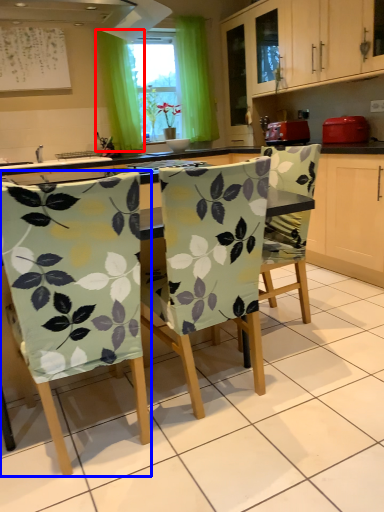
Question: Which of the following is the farthest to the observer, curtain (highlighted by a red box) or chair (highlighted by a blue box)?

Choices:
 (A) curtain
 (B) chair

Answer: (A)